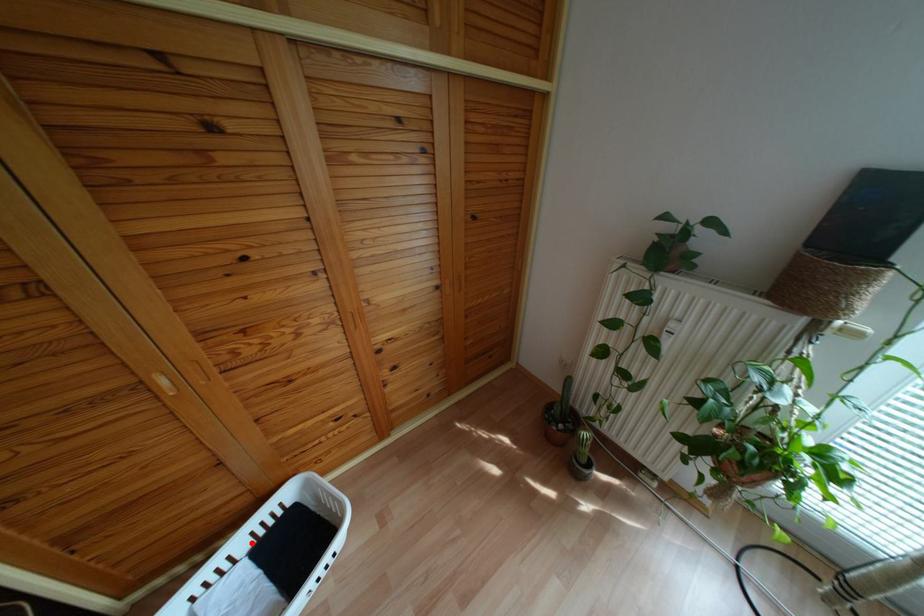
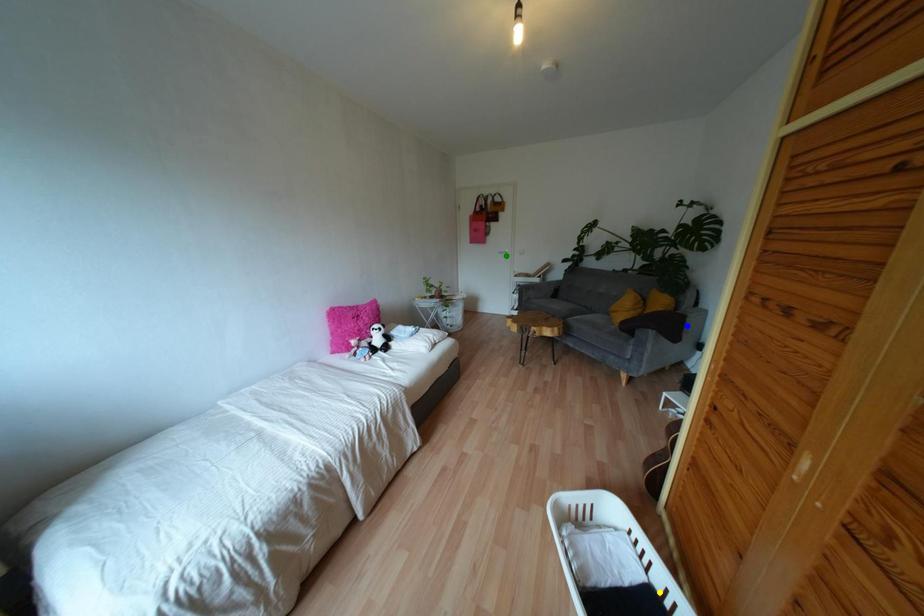
Question: I am providing you with two images of the same scene from different viewpoints. A red point is marked on the first image. You are given multiple points on the second image. In image 2, which mark is for the same physical point as the one in image 1?

Choices:
 (A) blue point
 (B) green point
 (C) yellow point

Answer: (C)